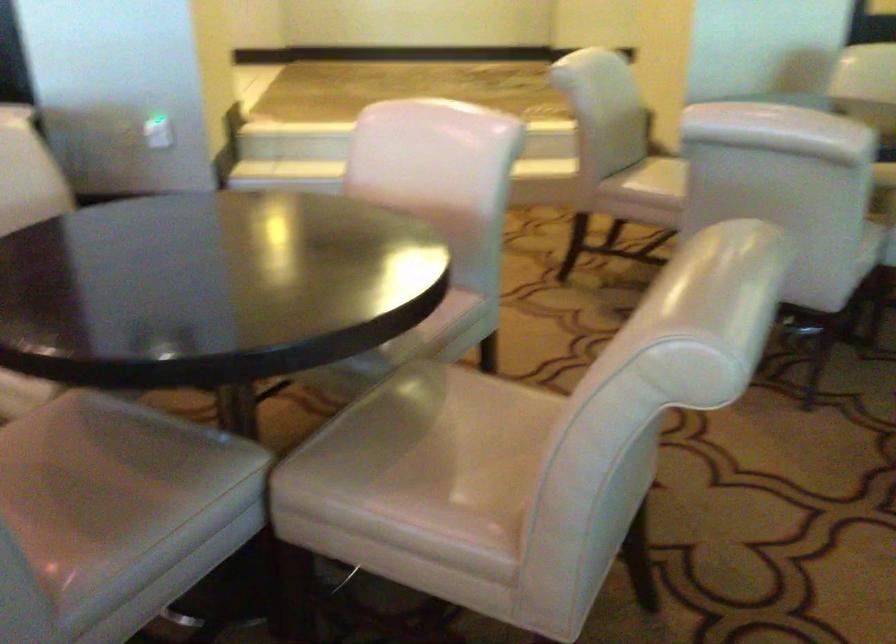
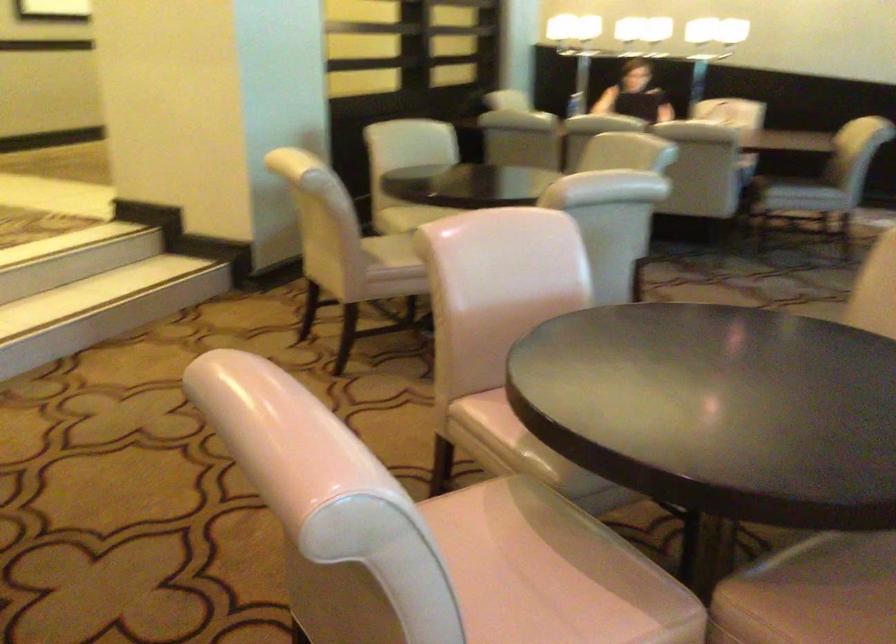
Find the pixel in the second image that matches the point at 81,442 in the first image.

(828, 590)